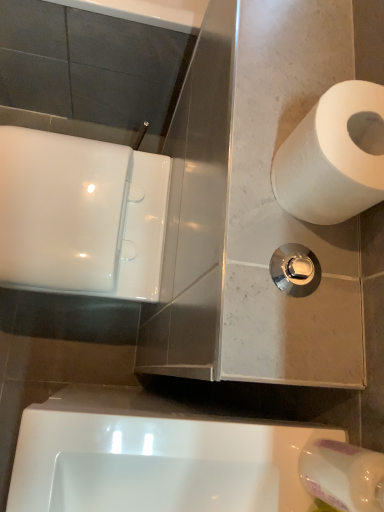
Question: In the image, is white paper at right, placed as the second toilet paper when sorted from bottom to top, positioned in front of or behind white matte toilet paper at upper right, the first toilet paper positioned from the bottom?

Choices:
 (A) behind
 (B) front

Answer: (A)

Question: Considering the positions of white paper at right, the 1th toilet paper when ordered from top to bottom, and white matte toilet paper at upper right, the first toilet paper positioned from the bottom, in the image, is white paper at right, the 1th toilet paper when ordered from top to bottom, taller or shorter than white matte toilet paper at upper right, the first toilet paper positioned from the bottom,?

Choices:
 (A) short
 (B) tall

Answer: (A)

Question: Which object is positioned closest to the white paper at right, placed as the second toilet paper when sorted from bottom to top?

Choices:
 (A) polished chrome flush handle at center-right
 (B) white matte toilet paper at upper right, the second toilet paper in the top-to-bottom sequence
 (C) white glossy urinal at lower center

Answer: (A)

Question: Which object is positioned closest to the white paper at right, placed as the second toilet paper when sorted from bottom to top?

Choices:
 (A) polished chrome flush handle at center-right
 (B) white glossy urinal at lower center
 (C) white matte toilet paper at upper right, the second toilet paper in the top-to-bottom sequence

Answer: (A)